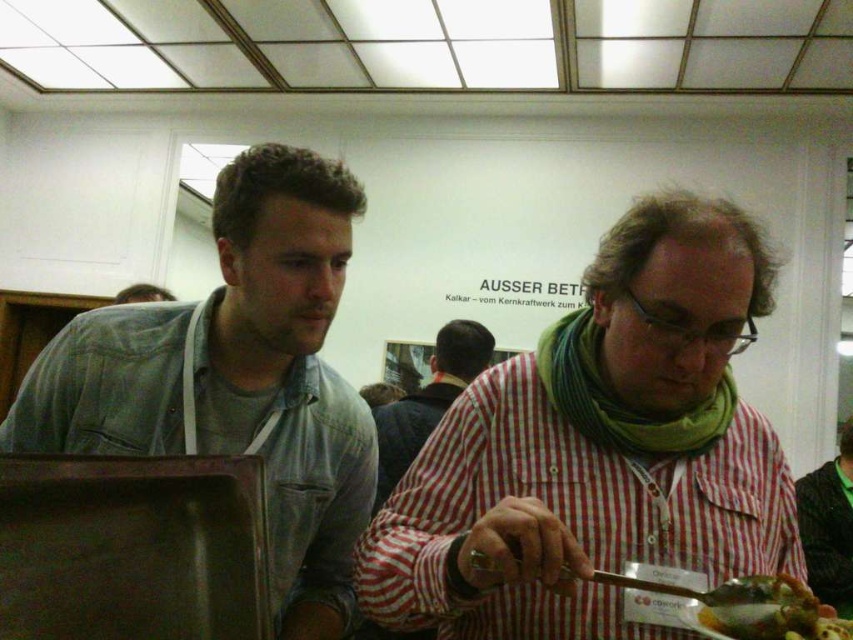
Can you confirm if red checkered shirt at center is positioned above green knitted scarf at lower right?

Yes.

The width and height of the screenshot is (853, 640). I want to click on red checkered shirt at center, so (x=427, y=400).

Find the location of a particular element. The width and height of the screenshot is (853, 640). red checkered shirt at center is located at coordinates (427, 400).

Can you confirm if red plaid shirt at center is positioned to the right of green leafy vegetable at lower right?

In fact, red plaid shirt at center is to the left of green leafy vegetable at lower right.

Is point (529, 449) less distant than point (798, 608)?

No, it is not.

Find the location of a particular element. red plaid shirt at center is located at coordinates (598, 451).

Is point (354, 512) closer to camera compared to point (399, 419)?

Yes.

Based on the photo, is denim shirt at left smaller than red checkered shirt at center?

Indeed, denim shirt at left has a smaller size compared to red checkered shirt at center.

Is point (126, 348) closer to viewer compared to point (439, 346)?

That is True.

Image resolution: width=853 pixels, height=640 pixels. In order to click on denim shirt at left in this screenshot , I will do `click(236, 376)`.